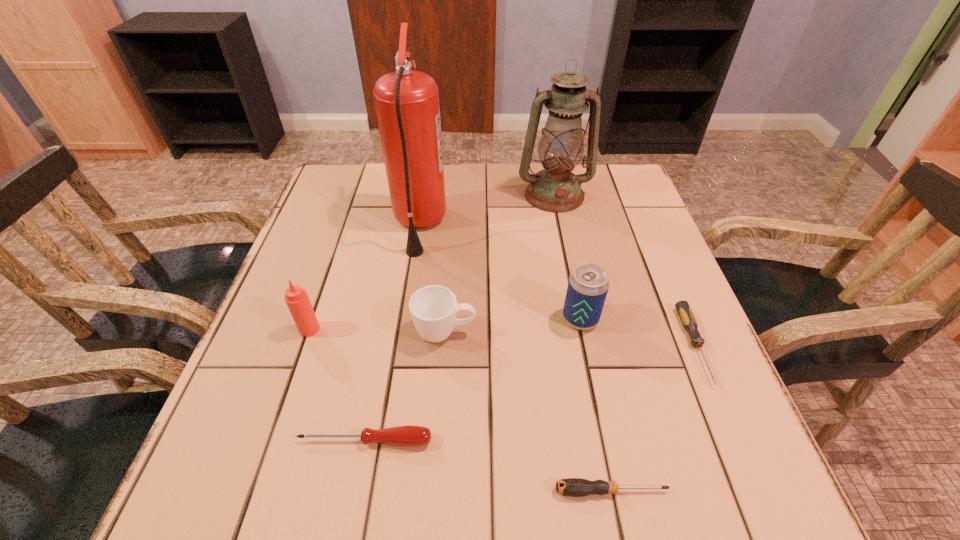
Locate an element on the screen. fire extinguisher is located at coordinates (407, 105).

Where is `oil lamp`? oil lamp is located at coordinates (555, 189).

The width and height of the screenshot is (960, 540). Find the location of `the leftmost object`. the leftmost object is located at coordinates (296, 298).

Identify the location of beer can. The width and height of the screenshot is (960, 540). (588, 285).

Find the location of a particular element. The width and height of the screenshot is (960, 540). the fifth tallest object is located at coordinates coord(433,308).

This screenshot has height=540, width=960. In order to click on the leftmost screwdriver in this screenshot , I will do `click(410, 435)`.

At what (x,y) coordinates should I click in order to perform the action: click on the third shortest object. Please return your answer as a coordinate pair (x, y). Looking at the image, I should click on (410, 435).

You are a GUI agent. You are given a task and a screenshot of the screen. Output one action in this format:
    pyautogui.click(x=<x>, y=<y>)
    Task: Click on the rightmost object
    This screenshot has width=960, height=540.
    Given the screenshot: What is the action you would take?
    pyautogui.click(x=684, y=311)

Identify the location of the rightmost screwdriver. (684, 311).

The height and width of the screenshot is (540, 960). I want to click on the nearest object, so click(x=574, y=487).